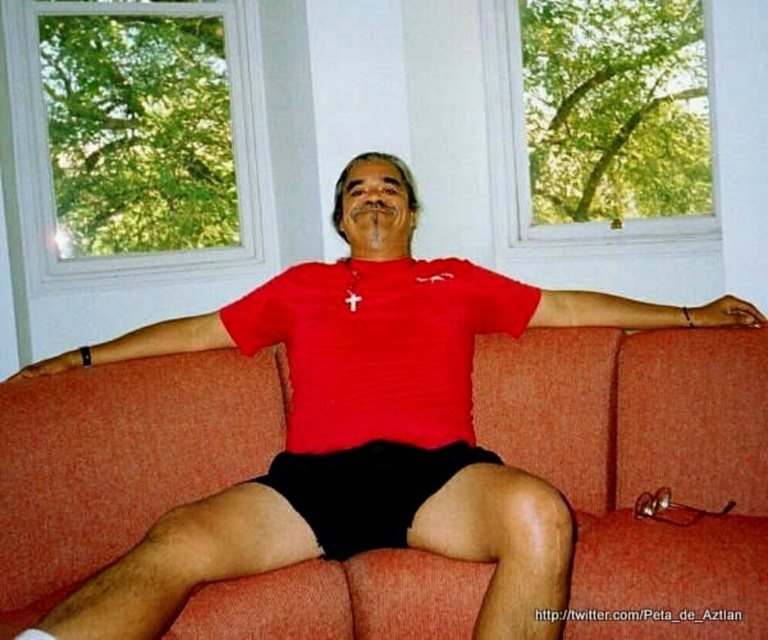
Question: Can you confirm if orange fabric couch at center is wider than black matte shorts at center?

Choices:
 (A) yes
 (B) no

Answer: (A)

Question: Which of the following is the closest to the observer?

Choices:
 (A) orange fabric couch at center
 (B) black matte shorts at center

Answer: (A)

Question: Can you confirm if orange fabric couch at center is positioned above black matte shorts at center?

Choices:
 (A) yes
 (B) no

Answer: (B)

Question: Which point appears closest to the camera in this image?

Choices:
 (A) (445, 461)
 (B) (35, 388)

Answer: (A)

Question: Does orange fabric couch at center appear on the left side of black matte shorts at center?

Choices:
 (A) no
 (B) yes

Answer: (A)